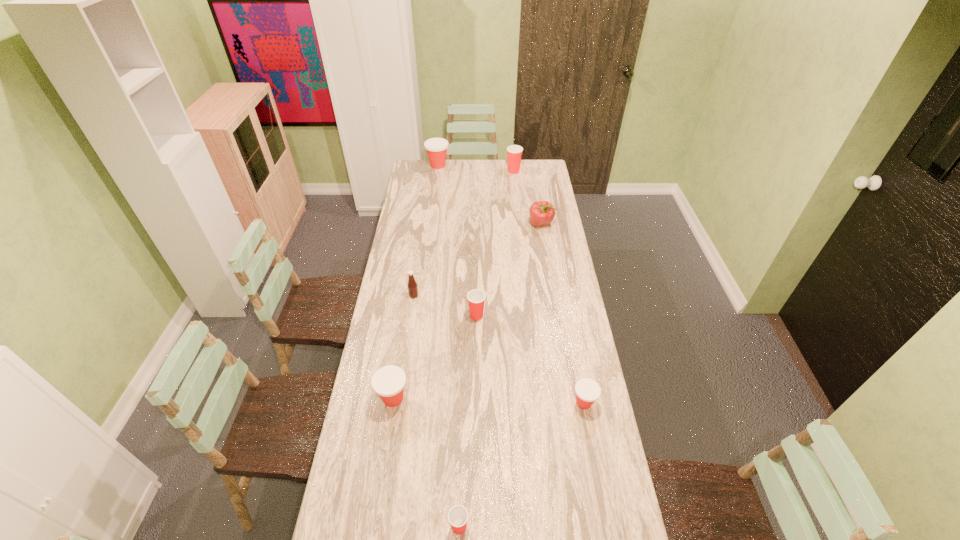
What are the coordinates of `red-orange Dixie cup that can be found as the second closest to the farthest red Dixie cup` in the screenshot? It's located at (587, 391).

Where is `the third closest red-orange Dixie cup to the third farthest object`? This screenshot has height=540, width=960. the third closest red-orange Dixie cup to the third farthest object is located at coordinates (388, 382).

You are a GUI agent. You are given a task and a screenshot of the screen. Output one action in this format:
    pyautogui.click(x=<x>, y=<y>)
    Task: Click on the red Dixie cup that is the second nearest to the rightmost red-orange Dixie cup
    
    Given the screenshot: What is the action you would take?
    pyautogui.click(x=458, y=515)

Where is `red Dixie cup identified as the closest to the farthest red-orange Dixie cup`? red Dixie cup identified as the closest to the farthest red-orange Dixie cup is located at coordinates (514, 152).

Image resolution: width=960 pixels, height=540 pixels. I want to click on free space in the image that satisfies the following two spatial constraints: 1. on the back side of the smallest red Dixie cup; 2. on the right side of the second nearest red Dixie cup, so click(x=466, y=315).

The width and height of the screenshot is (960, 540). Identify the location of vacant space that satisfies the following two spatial constraints: 1. on the front side of the second smallest red Dixie cup; 2. on the right side of the fourth farthest object. 411,315.

You are a GUI agent. You are given a task and a screenshot of the screen. Output one action in this format:
    pyautogui.click(x=<x>, y=<y>)
    Task: Click on the vacant area in the image that satisfies the following two spatial constraints: 1. on the back side of the Tabasco sauce; 2. on the left side of the third farthest object
    This screenshot has height=540, width=960.
    Given the screenshot: What is the action you would take?
    pyautogui.click(x=424, y=224)

The width and height of the screenshot is (960, 540). What are the coordinates of `free space that satisfies the following two spatial constraints: 1. on the back side of the pink bell pepper; 2. on the right side of the second biggest red Dixie cup` in the screenshot? It's located at (477, 224).